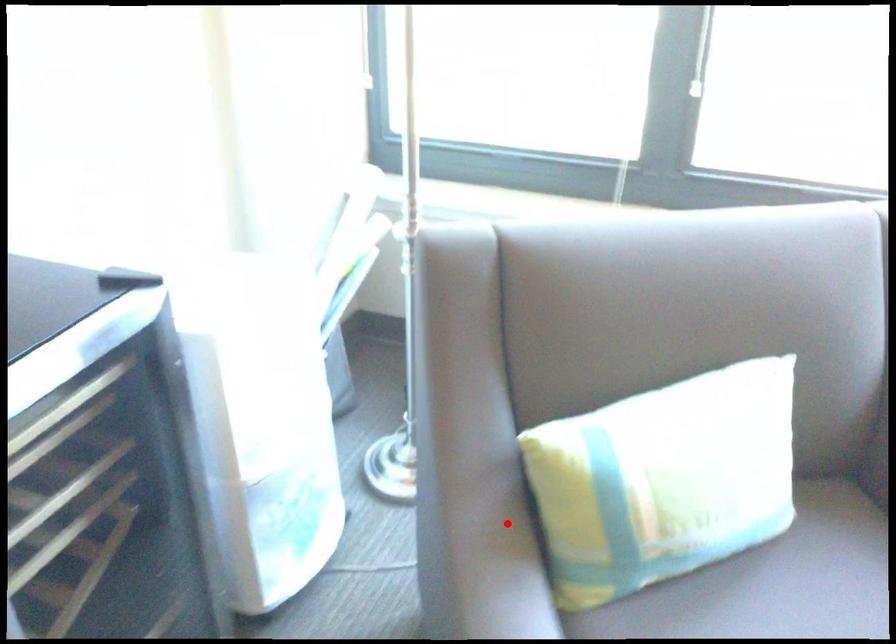
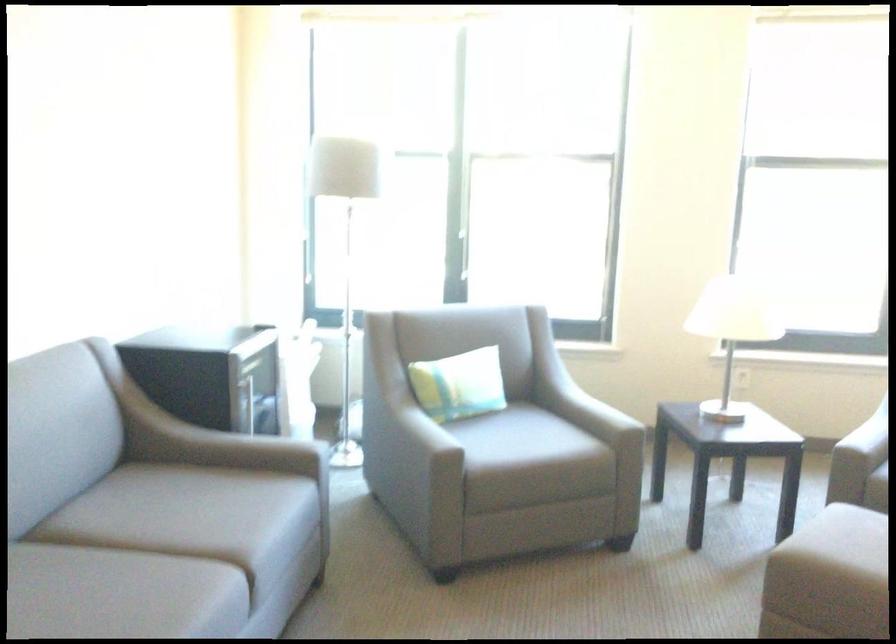
Question: A red point is marked in image1. In image2, is the corresponding 3D point closer to the camera or farther? Reply with the corresponding letter.

Choices:
 (A) The corresponding 3D point is closer.
 (B) The corresponding 3D point is farther.

Answer: (B)